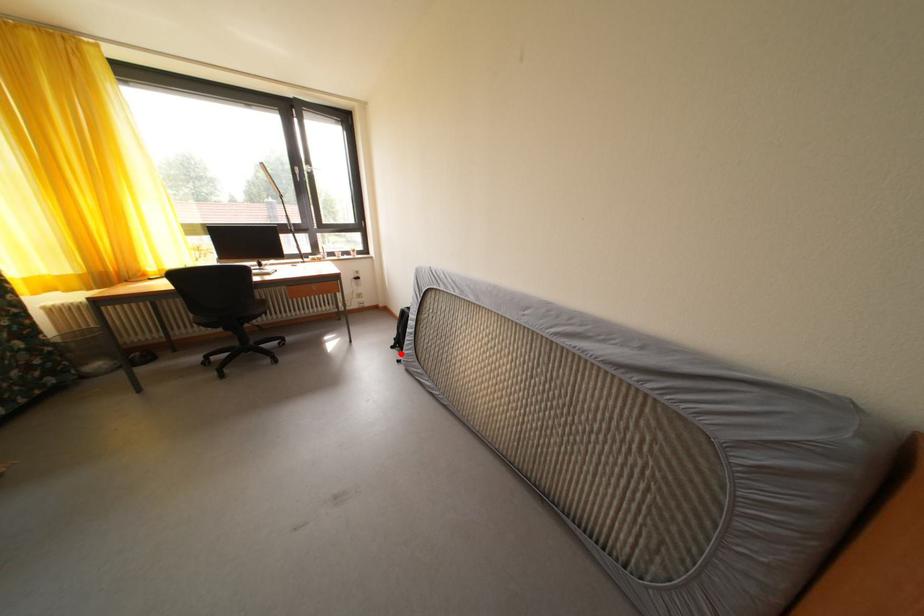
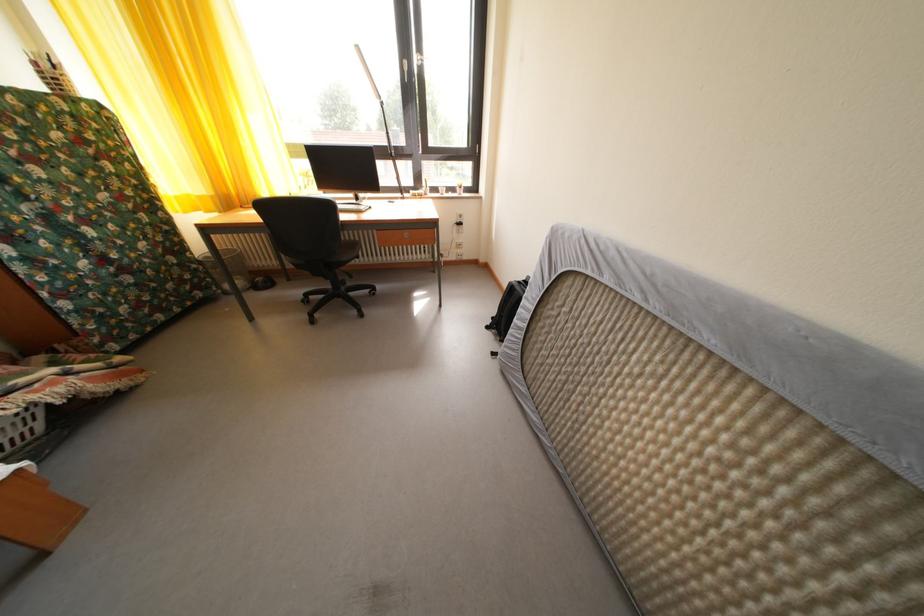
Find the pixel in the second image that matches the highlighted location in the first image.

(496, 334)